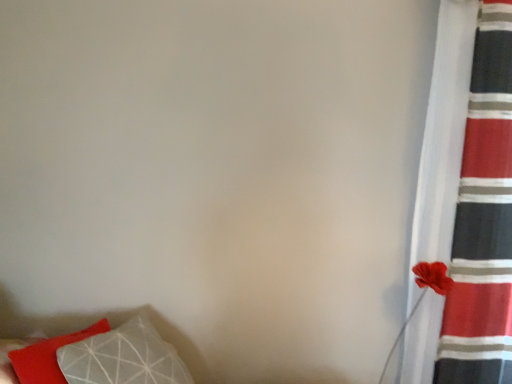
What do you see at coordinates (483, 218) in the screenshot?
I see `striped fabric curtain at right` at bounding box center [483, 218].

What is the approximate width of striped fabric curtain at right?

9.38 inches.

Where is `striped fabric curtain at right`? striped fabric curtain at right is located at coordinates (483, 218).

Locate an element on the screen. striped fabric curtain at right is located at coordinates (483, 218).